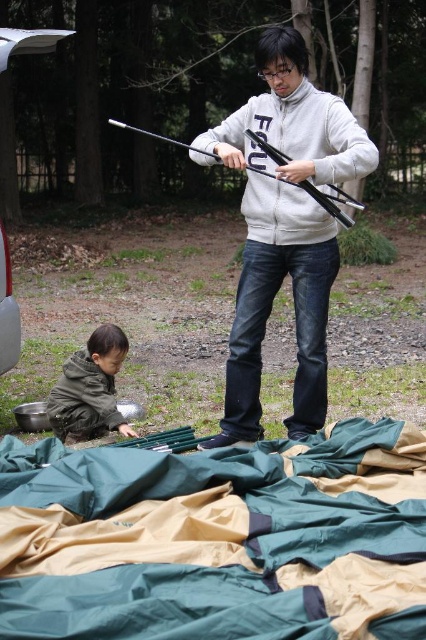
Question: Estimate the real-world distances between objects in this image. Which object is farther from the green fabric blanket at lower center?

Choices:
 (A) white matte jacket at center
 (B) dark green fabric at lower left
 (C) metallic silver minivan at lower left

Answer: (C)

Question: Is the position of green fabric blanket at lower center less distant than that of white matte jacket at center?

Choices:
 (A) yes
 (B) no

Answer: (A)

Question: Where is green fabric blanket at lower center located in relation to metallic silver minivan at lower left in the image?

Choices:
 (A) above
 (B) below

Answer: (B)

Question: Based on their relative distances, which object is farther from the white matte jacket at center?

Choices:
 (A) dark green fabric at lower left
 (B) metallic silver minivan at lower left
 (C) green fabric blanket at lower center

Answer: (B)

Question: Which object is closer to the camera taking this photo?

Choices:
 (A) green fabric blanket at lower center
 (B) metallic silver minivan at lower left
 (C) white matte jacket at center

Answer: (A)

Question: Can you confirm if white matte jacket at center is positioned below dark green fabric at lower left?

Choices:
 (A) yes
 (B) no

Answer: (B)